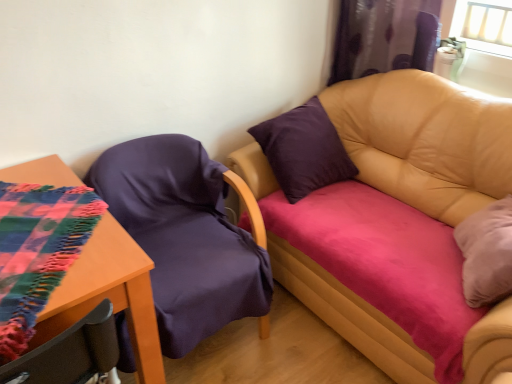
Question: Is wooden table at lower left surrounded by leather couch at upper right?

Choices:
 (A) yes
 (B) no

Answer: (B)

Question: Does leather couch at upper right have a lesser height compared to wooden table at lower left?

Choices:
 (A) no
 (B) yes

Answer: (A)

Question: Is leather couch at upper right facing towards wooden table at lower left?

Choices:
 (A) no
 (B) yes

Answer: (B)

Question: Is leather couch at upper right bigger than wooden table at lower left?

Choices:
 (A) no
 (B) yes

Answer: (B)

Question: Is leather couch at upper right with wooden table at lower left?

Choices:
 (A) no
 (B) yes

Answer: (A)

Question: Is leather couch at upper right taller than wooden table at lower left?

Choices:
 (A) yes
 (B) no

Answer: (A)

Question: Are purple fabric chair at left and leather couch at upper right far apart?

Choices:
 (A) yes
 (B) no

Answer: (B)

Question: From the image's perspective, is purple fabric chair at left under leather couch at upper right?

Choices:
 (A) yes
 (B) no

Answer: (A)

Question: Is purple fabric chair at left outside leather couch at upper right?

Choices:
 (A) no
 (B) yes

Answer: (B)

Question: Is purple fabric chair at left in front of leather couch at upper right?

Choices:
 (A) no
 (B) yes

Answer: (A)

Question: Is purple fabric chair at left positioned behind leather couch at upper right?

Choices:
 (A) yes
 (B) no

Answer: (A)

Question: Considering the relative sizes of purple fabric chair at left and leather couch at upper right in the image provided, is purple fabric chair at left thinner than leather couch at upper right?

Choices:
 (A) yes
 (B) no

Answer: (A)

Question: From a real-world perspective, is purple satin curtain at upper right positioned over purple fabric chair at left based on gravity?

Choices:
 (A) yes
 (B) no

Answer: (A)